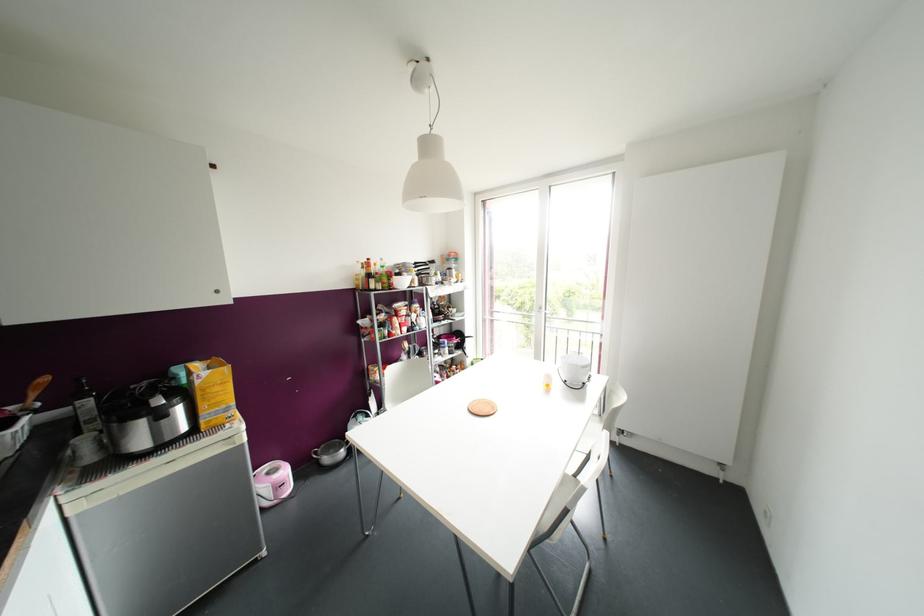
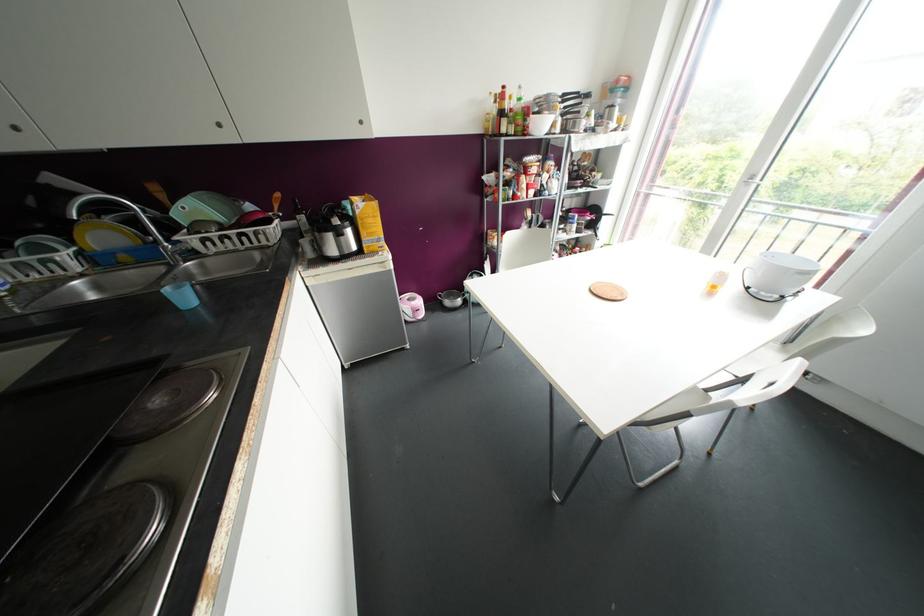
In the second image, find the point that corresponds to point (546, 385) in the first image.

(713, 286)